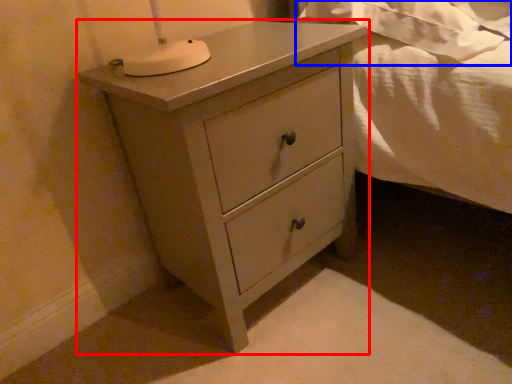
Question: Which of the following is the closest to the observer, chest of drawers (highlighted by a red box) or sheet (highlighted by a blue box)?

Choices:
 (A) chest of drawers
 (B) sheet

Answer: (A)